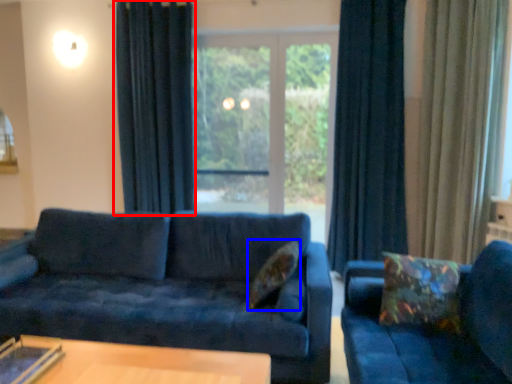
Question: Among these objects, which one is farthest to the camera, curtain (highlighted by a red box) or pillow (highlighted by a blue box)?

Choices:
 (A) curtain
 (B) pillow

Answer: (A)